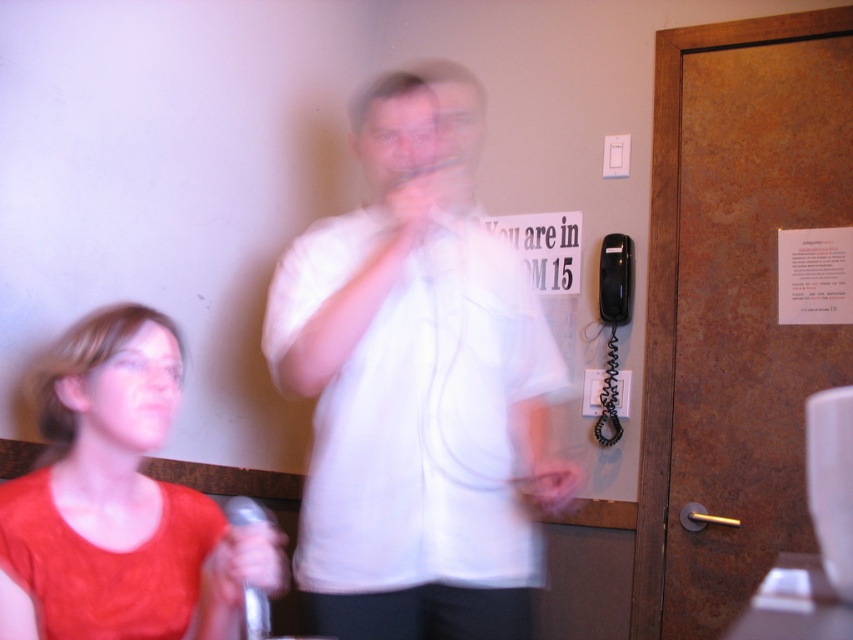
Question: Considering the relative positions of white matte shirt at center and matte red shirt at left in the image provided, where is white matte shirt at center located with respect to matte red shirt at left?

Choices:
 (A) above
 (B) below

Answer: (A)

Question: Is white matte shirt at center wider than matte red shirt at left?

Choices:
 (A) yes
 (B) no

Answer: (A)

Question: Is white matte shirt at center above matte red shirt at left?

Choices:
 (A) yes
 (B) no

Answer: (A)